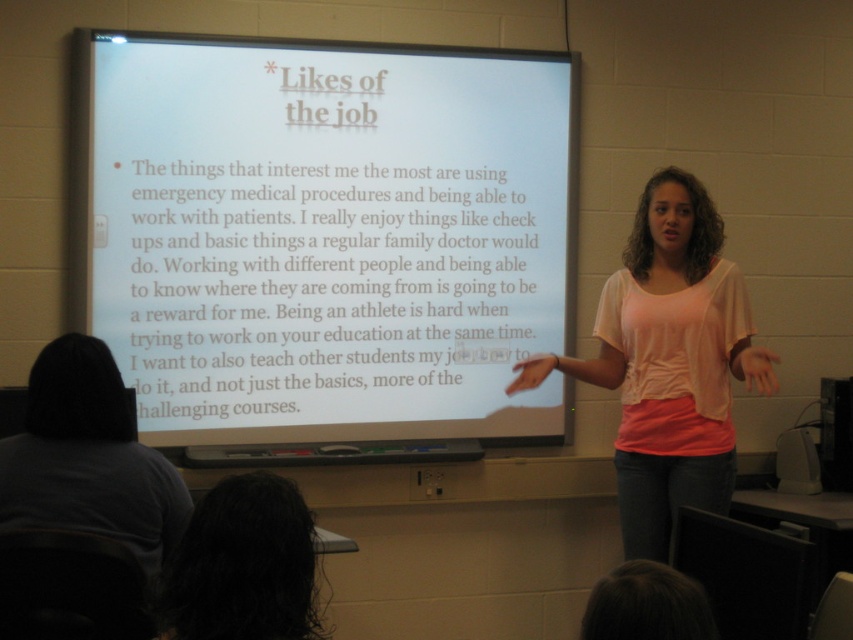
Is white matte projector screen at upper center to the left of dark curly hair at lower left from the viewer's perspective?

No, white matte projector screen at upper center is not to the left of dark curly hair at lower left.

Based on the photo, between white matte projector screen at upper center and dark curly hair at lower left, which one is positioned higher?

white matte projector screen at upper center

Which is in front, point (193, 365) or point (227, 493)?

Point (227, 493) is in front.

Locate an element on the screen. white matte projector screen at upper center is located at coordinates (329, 236).

Which is more to the right, pink cotton shirt at center or dark curly hair at lower left?

pink cotton shirt at center

Which is in front, point (660, 547) or point (209, 493)?

Point (209, 493) is in front.

Where is `pink cotton shirt at center`? pink cotton shirt at center is located at coordinates (669, 362).

Can you confirm if white matte projector screen at upper center is taller than gray cotton shirt at lower left?

Yes, white matte projector screen at upper center is taller than gray cotton shirt at lower left.

Does white matte projector screen at upper center have a larger size compared to gray cotton shirt at lower left?

Correct, white matte projector screen at upper center is larger in size than gray cotton shirt at lower left.

Between point (486, 336) and point (112, 392), which one is positioned behind?

The point (486, 336) is more distant.

This screenshot has width=853, height=640. Identify the location of white matte projector screen at upper center. (329, 236).